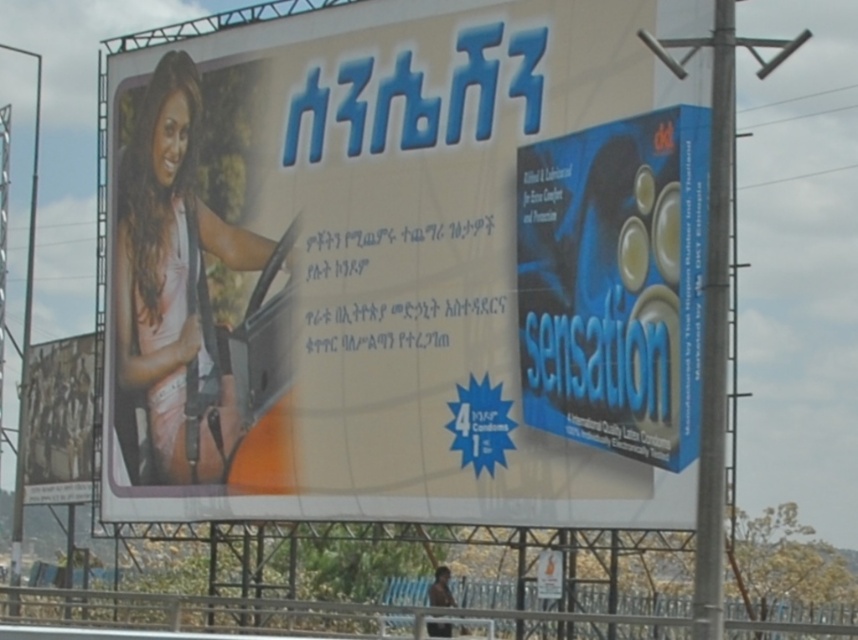
Which is behind, point (381, 470) or point (600, 445)?

The point (381, 470) is more distant.

Can you confirm if matte white billboard at center is positioned to the right of blue cardboard sensation at right?

In fact, matte white billboard at center is to the left of blue cardboard sensation at right.

At what (x,y) coordinates should I click in order to perform the action: click on matte white billboard at center. Please return your answer as a coordinate pair (x, y). Looking at the image, I should click on (405, 272).

Can you confirm if matte white billboard at center is positioned above matte pink shirt at left?

Actually, matte white billboard at center is below matte pink shirt at left.

Who is higher up, matte white billboard at center or matte pink shirt at left?

matte pink shirt at left is above.

Is point (571, 248) positioned behind point (285, 278)?

No, (571, 248) is closer to viewer.

I want to click on matte white billboard at center, so click(x=405, y=272).

Can you confirm if matte white billboard at center is positioned below rustic wood sign at lower left?

Actually, matte white billboard at center is above rustic wood sign at lower left.

Which is in front, point (148, 192) or point (31, 486)?

Positioned in front is point (148, 192).

Which is behind, point (492, 68) or point (58, 362)?

Point (58, 362)

At what (x,y) coordinates should I click in order to perform the action: click on matte white billboard at center. Please return your answer as a coordinate pair (x, y). The image size is (858, 640). Looking at the image, I should click on (405, 272).